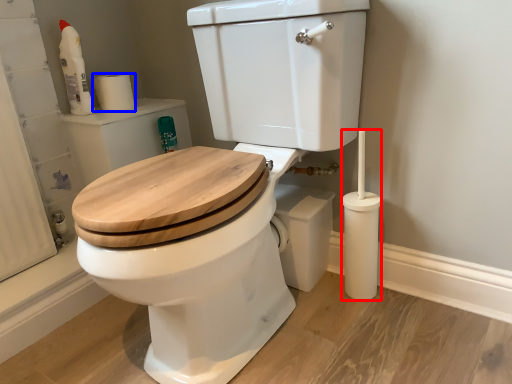
Question: Which object is closer to the camera taking this photo, brush (highlighted by a red box) or toilet paper (highlighted by a blue box)?

Choices:
 (A) brush
 (B) toilet paper

Answer: (A)